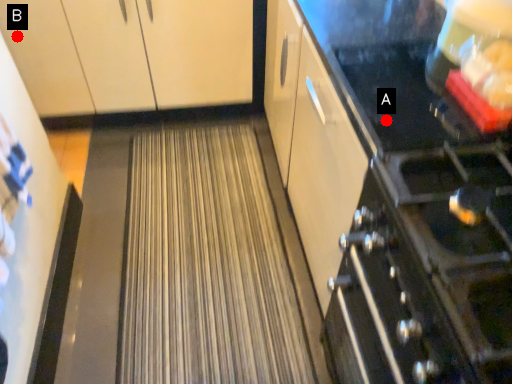
Question: Two points are circled on the image, labeled by A and B beside each circle. Which point appears farthest from the camera in this image?

Choices:
 (A) A is further
 (B) B is further

Answer: (B)